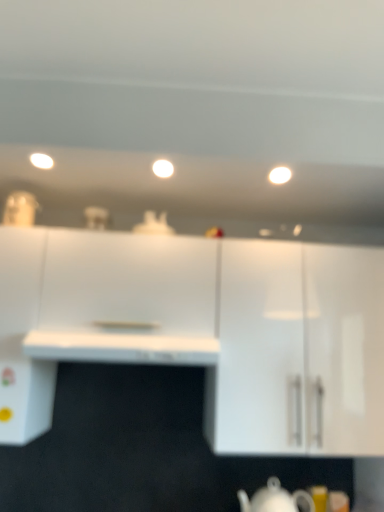
In order to click on unoccupied region to the right of white glossy light fixture at center, which appears as the 2th lighting when viewed from the right in this screenshot , I will do `click(206, 167)`.